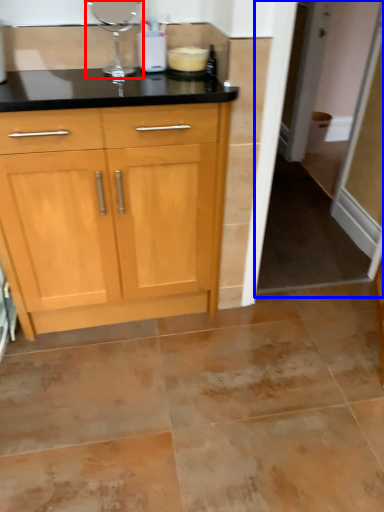
Question: Among these objects, which one is nearest to the camera, appliance (highlighted by a red box) or screen door (highlighted by a blue box)?

Choices:
 (A) appliance
 (B) screen door

Answer: (A)